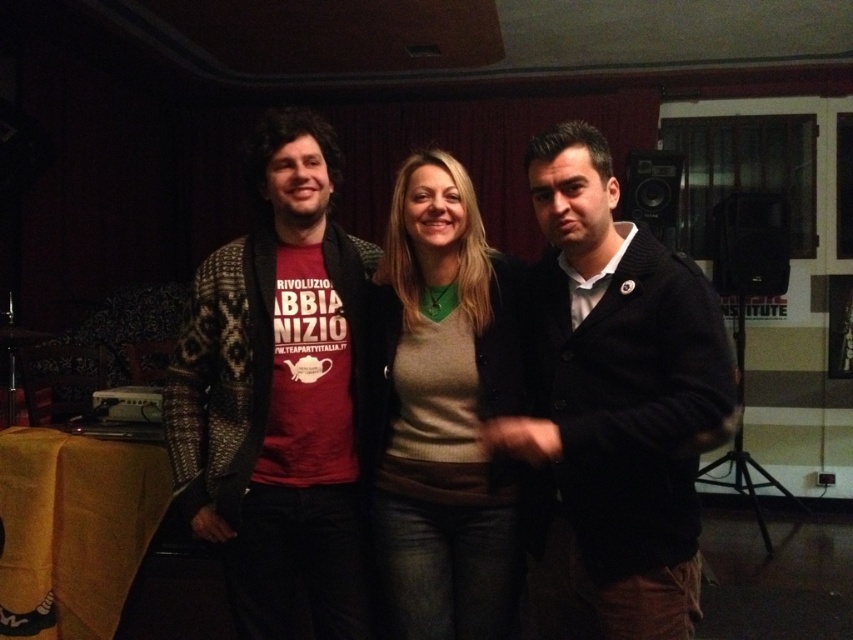
Does dark woolen jacket at center appear on the right side of matte beige sweater at center?

Indeed, dark woolen jacket at center is positioned on the right side of matte beige sweater at center.

Based on the photo, between dark woolen jacket at center and matte beige sweater at center, which one appears on the left side from the viewer's perspective?

matte beige sweater at center is more to the left.

What do you see at coordinates (616, 404) in the screenshot? I see `dark woolen jacket at center` at bounding box center [616, 404].

What are the coordinates of `dark woolen jacket at center` in the screenshot? It's located at (616, 404).

Which is below, dark woolen jacket at center or knitted sweater at center?

dark woolen jacket at center is lower down.

Between dark woolen jacket at center and knitted sweater at center, which one has more height?

Standing taller between the two is knitted sweater at center.

Is point (567, 156) more distant than point (218, 474)?

No, (567, 156) is in front of (218, 474).

Locate an element on the screen. dark woolen jacket at center is located at coordinates (616, 404).

Does knitted sweater at center have a larger size compared to matte beige sweater at center?

Yes, knitted sweater at center is bigger than matte beige sweater at center.

Who is more forward, (357, 314) or (494, 272)?

Positioned in front is point (494, 272).

The height and width of the screenshot is (640, 853). In order to click on knitted sweater at center in this screenshot , I will do `click(277, 394)`.